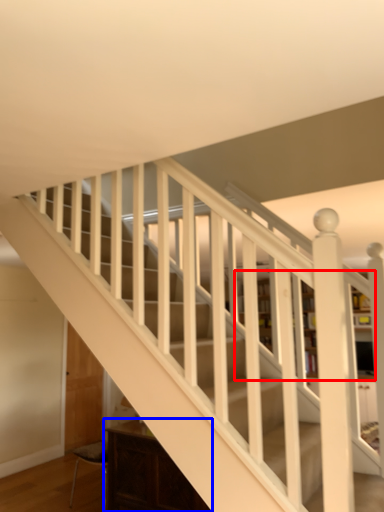
Question: Which object appears farthest to the camera in this image, bookcase (highlighted by a red box) or furniture (highlighted by a blue box)?

Choices:
 (A) bookcase
 (B) furniture

Answer: (A)